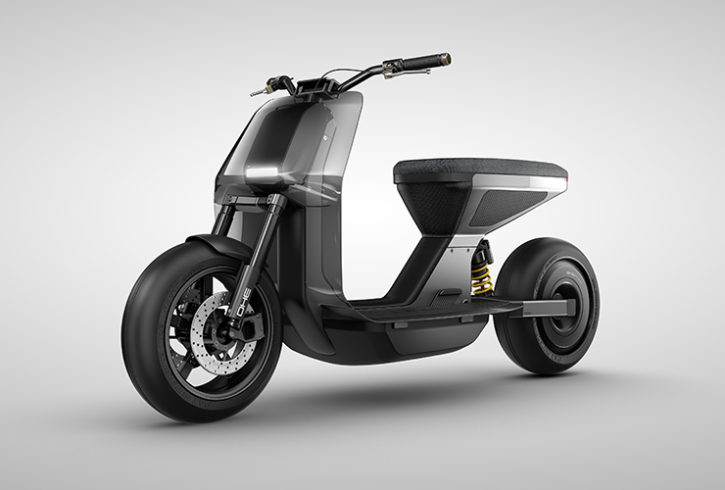
Find the location of a particular element. The height and width of the screenshot is (490, 725). foot rest is located at coordinates (380, 298).